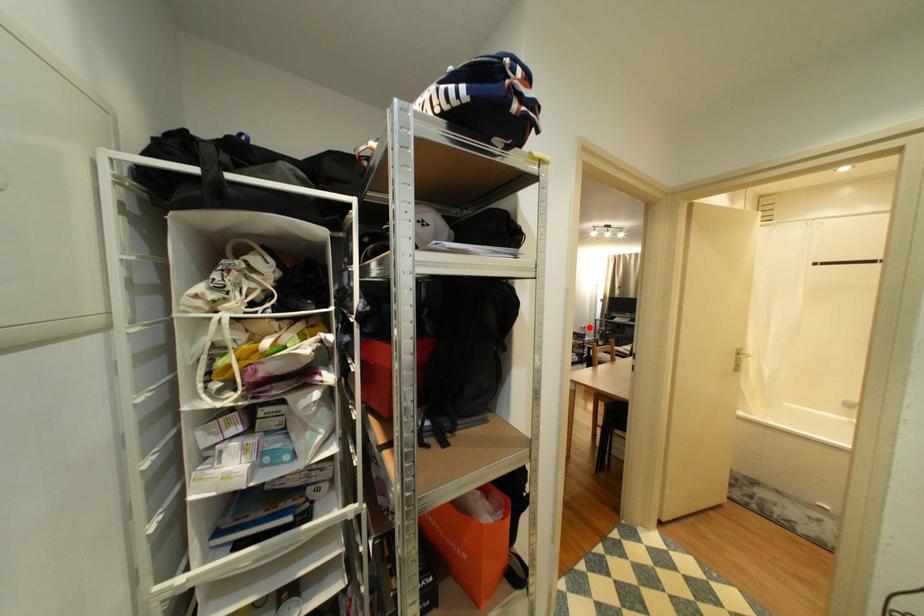
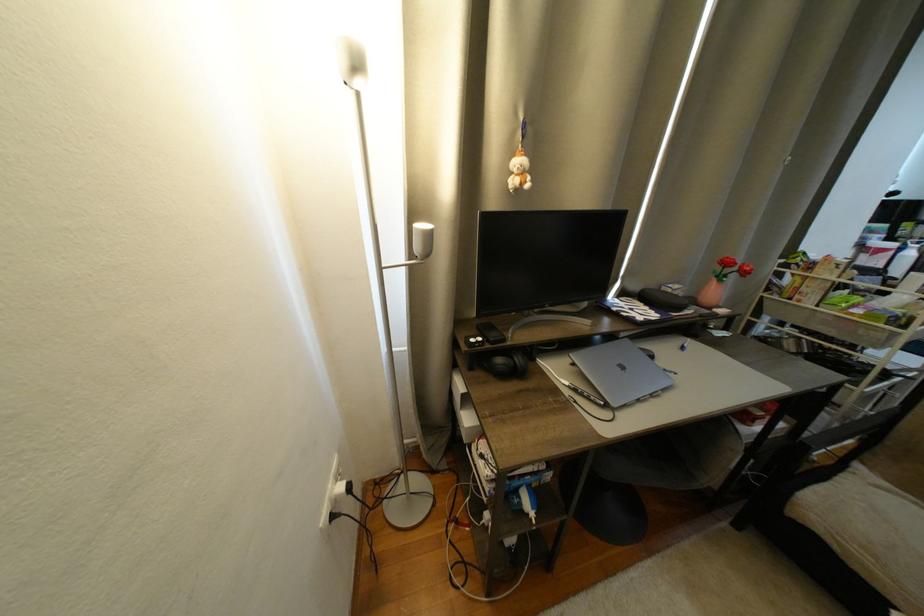
Question: I am providing you with two images of the same scene from different viewpoints. A red point is shown in image1. For the corresponding object point in image2, is it positioned nearer or farther from the camera?

Choices:
 (A) Nearer
 (B) Farther

Answer: (A)